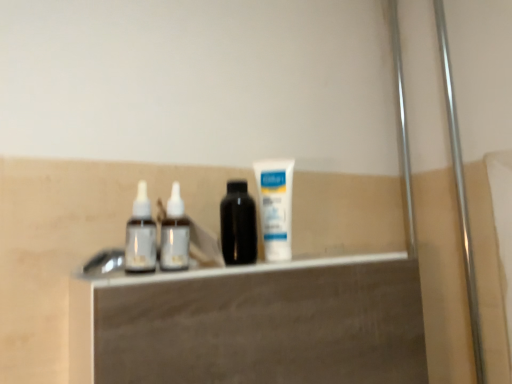
Question: Is white matte tube at center shorter than white glossy vanity at center?

Choices:
 (A) no
 (B) yes

Answer: (B)

Question: Is white matte tube at center positioned behind white glossy vanity at center?

Choices:
 (A) no
 (B) yes

Answer: (B)

Question: Is white matte tube at center bigger than white glossy vanity at center?

Choices:
 (A) yes
 (B) no

Answer: (B)

Question: Is white matte tube at center outside white glossy vanity at center?

Choices:
 (A) yes
 (B) no

Answer: (A)

Question: Would you say white matte tube at center contains white glossy vanity at center?

Choices:
 (A) yes
 (B) no

Answer: (B)

Question: Is white matte tube at center oriented towards white glossy vanity at center?

Choices:
 (A) yes
 (B) no

Answer: (B)

Question: From the image's perspective, does white glossy vanity at center appear lower than white matte tube at center?

Choices:
 (A) no
 (B) yes

Answer: (B)

Question: Can you confirm if white glossy vanity at center is thinner than white matte tube at center?

Choices:
 (A) yes
 (B) no

Answer: (B)

Question: Does white glossy vanity at center have a lesser height compared to white matte tube at center?

Choices:
 (A) no
 (B) yes

Answer: (A)

Question: Is the depth of white glossy vanity at center less than that of white matte tube at center?

Choices:
 (A) no
 (B) yes

Answer: (B)

Question: Is the position of white glossy vanity at center more distant than that of white matte tube at center?

Choices:
 (A) yes
 (B) no

Answer: (B)

Question: Could you tell me if white glossy vanity at center is facing white matte tube at center?

Choices:
 (A) no
 (B) yes

Answer: (A)

Question: Looking at their shapes, would you say white matte tube at center is wider or thinner than white glossy vanity at center?

Choices:
 (A) thin
 (B) wide

Answer: (A)